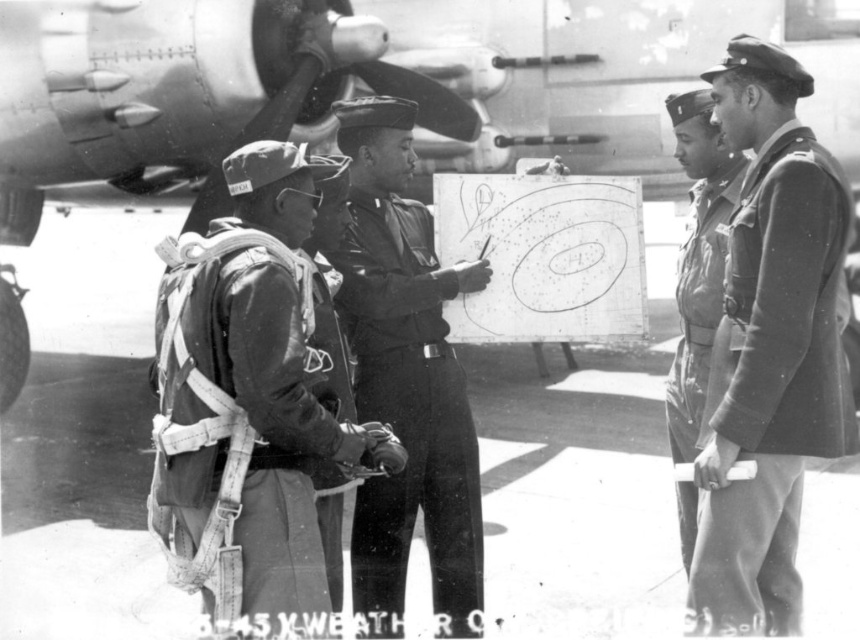
At what (x,y) coordinates should I click in order to perform the action: click on camouflage fabric parachute at left. Please return your answer as a coordinate pair (x, y). This screenshot has height=640, width=860. Looking at the image, I should click on (238, 422).

Can you confirm if camouflage fabric parachute at left is bigger than camouflage fabric uniform at right?

Yes, camouflage fabric parachute at left is bigger than camouflage fabric uniform at right.

Does point (191, 481) come farther from viewer compared to point (714, 310)?

No.

This screenshot has width=860, height=640. I want to click on camouflage fabric parachute at left, so click(238, 422).

Is camouflage fabric parachute at left further to camera compared to uniform fabric at right?

No.

Between camouflage fabric parachute at left and uniform fabric at right, which one is positioned higher?

uniform fabric at right is higher up.

Between point (249, 378) and point (753, 580), which one is positioned behind?

Point (753, 580)

Find the location of a particular element. Image resolution: width=860 pixels, height=640 pixels. camouflage fabric parachute at left is located at coordinates (238, 422).

Which is in front, point (756, 404) or point (704, 246)?

Positioned in front is point (756, 404).

At what (x,y) coordinates should I click in order to perform the action: click on uniform fabric at right. Please return your answer as a coordinate pair (x, y). Image resolution: width=860 pixels, height=640 pixels. Looking at the image, I should click on click(x=774, y=380).